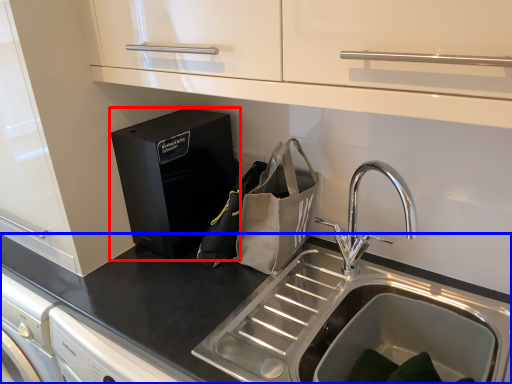
Question: Which point is further to the camera, home appliance (highlighted by a red box) or countertop (highlighted by a blue box)?

Choices:
 (A) home appliance
 (B) countertop

Answer: (A)